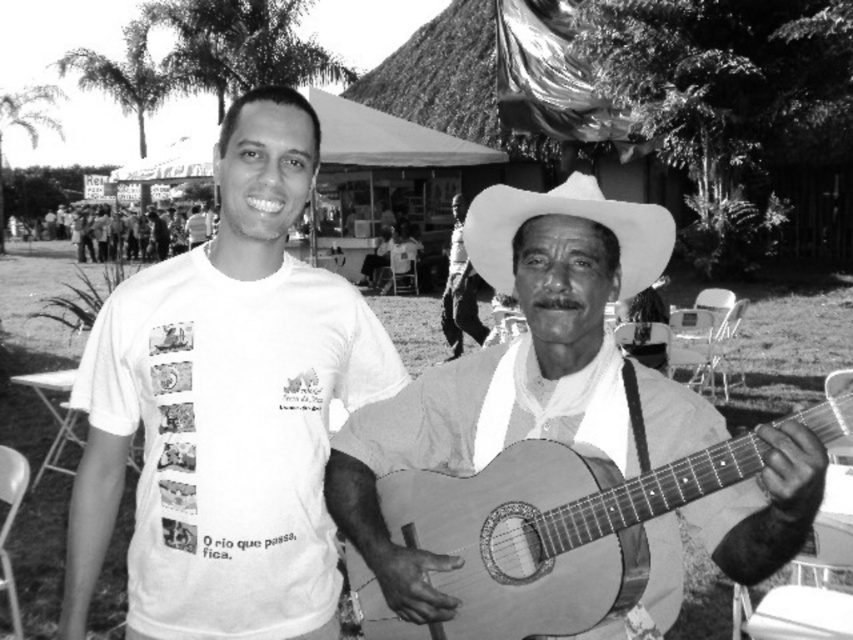
You are a photographer trying to focus on the point at coordinates (225,408) in the image. Which object from the scene should you adjust your focus to ensure it captures that point accurately?

The point at coordinates (225,408) is on the white cotton t shirt at center, so you should adjust your focus to capture the white cotton t shirt at center.

You are a photographer adjusting your camera settings. You notice two white items in the frame, the white felt sombrero at center and the matte white shirt at center. Which item appears closer to you?

The white felt sombrero at center is closer to the viewer than the matte white shirt at center.

You are standing in front of the photograph and want to determine which of the two points, point (360, 388) or point (553, 211), is closer to you. Based on the description, which point is nearer?

Point (360, 388) is further to the viewer than point (553, 211), so point (553, 211) is closer to you.